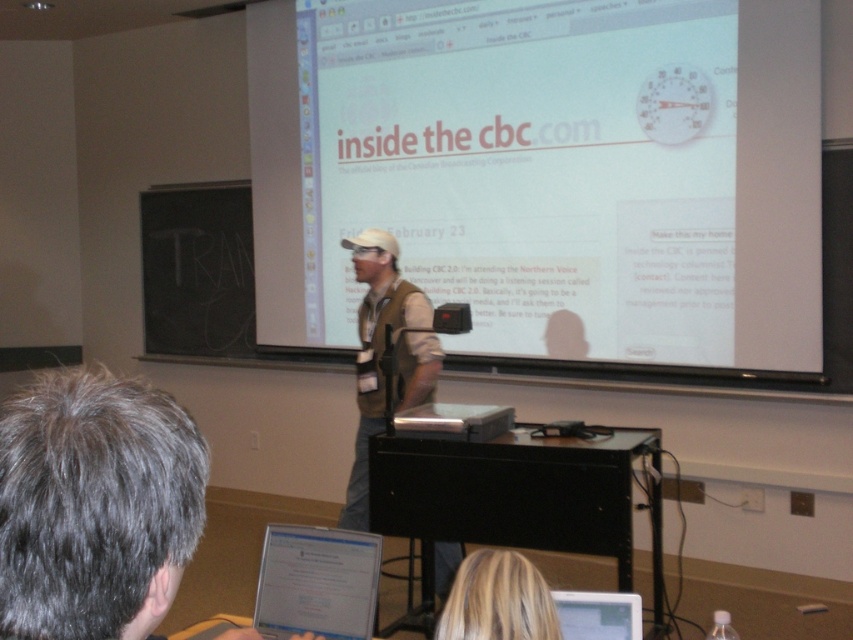
You are a student sitting at the back of the classroom. You need to locate the white glossy tablet at lower center for your next task. According to the coordinates provided, where exactly should you look to find it?

The white glossy tablet at lower center is located at point (316,582), so you should look towards the lower center area of the image to find it.

You are standing in the classroom and need to walk from point A to point B. Point A is at coordinates point (793, 204) and point B is at point (589, 608). According to the scene description, which point is closer to the front of the classroom?

Point (589, 608) is closer to the front of the classroom because it is in front of point (793, 204), which is behind it.

Consider the image. You are a student sitting at the back of the classroom. You need to see both the silver metallic laptop at lower center and the white matte projection screen at center clearly. Which one is closer to you?

The silver metallic laptop at lower center is behind the white matte projection screen at center, so the white matte projection screen at center is closer to you.